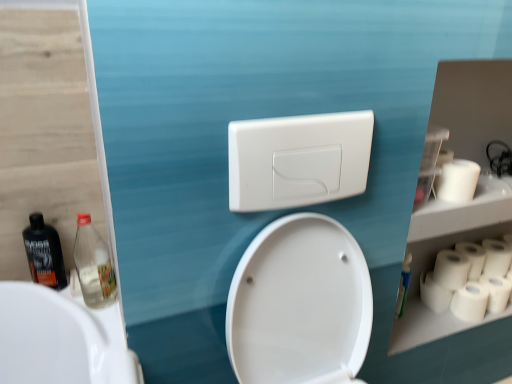
Where is `vacant space to the left of white matte toilet paper at right, placed as the 3th toilet paper when sorted from bottom to top`? The height and width of the screenshot is (384, 512). vacant space to the left of white matte toilet paper at right, placed as the 3th toilet paper when sorted from bottom to top is located at coordinates (408, 307).